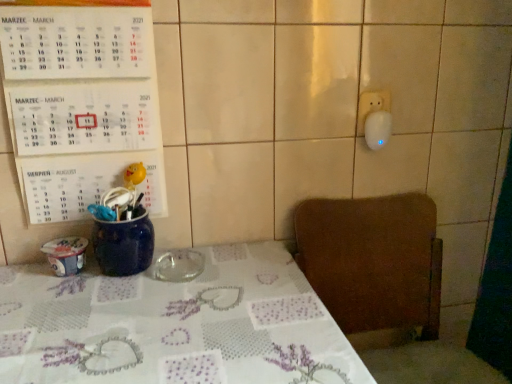
Looking at this image, measure the distance between brown wooden chair at lower right and camera.

brown wooden chair at lower right is 1.01 meters away from camera.

This screenshot has width=512, height=384. What do you see at coordinates (179, 265) in the screenshot?
I see `transparent glass ashtray at center` at bounding box center [179, 265].

The width and height of the screenshot is (512, 384). Find the location of `brown wooden chair at lower right`. brown wooden chair at lower right is located at coordinates (374, 265).

Does point (436, 303) come behind point (182, 262)?

Yes, point (436, 303) is farther from viewer.

Is brown wooden chair at lower right far from transparent glass ashtray at center?

No, brown wooden chair at lower right is not far away from transparent glass ashtray at center.

Which object is closer to the camera, brown wooden chair at lower right or transparent glass ashtray at center?

brown wooden chair at lower right is in front.

Who is taller, brown wooden chair at lower right or transparent glass ashtray at center?

brown wooden chair at lower right.

Visually, is white paper calendar at upper left positioned to the left or to the right of transparent glass ashtray at center?

white paper calendar at upper left is to the left of transparent glass ashtray at center.

From a real-world perspective, is white paper calendar at upper left physically located above or below transparent glass ashtray at center?

In terms of real-world spatial position, white paper calendar at upper left is above transparent glass ashtray at center.

Identify the location of bulletin board on the left of transparent glass ashtray at center. (80, 103).

Does transparent glass ashtray at center appear on the right side of white paper calendar at upper left?

Yes.

Based on the photo, which is further, (198,274) or (110,169)?

The point (110,169) is farther.

This screenshot has height=384, width=512. What are the coordinates of `bulletin board above the transparent glass ashtray at center (from a real-world perspective)` in the screenshot? It's located at (80, 103).

Can you see transparent glass ashtray at center touching white paper calendar at upper left?

transparent glass ashtray at center is not next to white paper calendar at upper left, and they're not touching.

How distant is brown wooden chair at lower right from white paper calendar at upper left?

They are 21.64 inches apart.

From a real-world perspective, who is located higher, brown wooden chair at lower right or white paper calendar at upper left?

white paper calendar at upper left is physically above.

Can you confirm if brown wooden chair at lower right is smaller than white paper calendar at upper left?

Incorrect, brown wooden chair at lower right is not smaller in size than white paper calendar at upper left.

Looking at this image, is brown wooden chair at lower right positioned with its back to white paper calendar at upper left?

No, brown wooden chair at lower right's orientation is not away from white paper calendar at upper left.

Can you confirm if white paper calendar at upper left is taller than brown wooden chair at lower right?

No, white paper calendar at upper left is not taller than brown wooden chair at lower right.

I want to click on bulletin board above the brown wooden chair at lower right (from a real-world perspective), so click(x=80, y=103).

Which object is closer to the camera, white paper calendar at upper left or brown wooden chair at lower right?

brown wooden chair at lower right is closer to the camera.

Is white paper calendar at upper left facing away from brown wooden chair at lower right?

That's not correct — white paper calendar at upper left is not looking away from brown wooden chair at lower right.

Is transparent glass ashtray at center far away from brown wooden chair at lower right?

That's not correct — transparent glass ashtray at center is a little close to brown wooden chair at lower right.

Could you tell me if transparent glass ashtray at center is facing brown wooden chair at lower right?

No, transparent glass ashtray at center does not turn towards brown wooden chair at lower right.

In order to click on chair on the right of transparent glass ashtray at center in this screenshot , I will do `click(374, 265)`.

Does point (167, 262) lie behind point (431, 272)?

No, (167, 262) is closer to viewer.

What are the coordinates of `chair directly beneath the transparent glass ashtray at center (from a real-world perspective)` in the screenshot? It's located at (374, 265).

This screenshot has height=384, width=512. In order to click on tableware lying below the white paper calendar at upper left (from the image's perspective) in this screenshot , I will do `click(179, 265)`.

When comparing their distances from brown wooden chair at lower right, does transparent glass ashtray at center or white paper calendar at upper left seem closer?

transparent glass ashtray at center is closer to brown wooden chair at lower right.

When comparing their distances from transparent glass ashtray at center, does white paper calendar at upper left or brown wooden chair at lower right seem further?

Among the two, brown wooden chair at lower right is located further to transparent glass ashtray at center.

Which object lies nearer to the anchor point transparent glass ashtray at center, brown wooden chair at lower right or white paper calendar at upper left?

Among the two, white paper calendar at upper left is located nearer to transparent glass ashtray at center.

Based on their spatial positions, is transparent glass ashtray at center or brown wooden chair at lower right closer to white paper calendar at upper left?

transparent glass ashtray at center.

Which object lies nearer to the anchor point brown wooden chair at lower right, white paper calendar at upper left or transparent glass ashtray at center?

The object closer to brown wooden chair at lower right is transparent glass ashtray at center.

When comparing their distances from white paper calendar at upper left, does brown wooden chair at lower right or transparent glass ashtray at center seem closer?

transparent glass ashtray at center is closer to white paper calendar at upper left.

Where is `tableware between white paper calendar at upper left and brown wooden chair at lower right in the horizontal direction`? The width and height of the screenshot is (512, 384). tableware between white paper calendar at upper left and brown wooden chair at lower right in the horizontal direction is located at coordinates (179, 265).